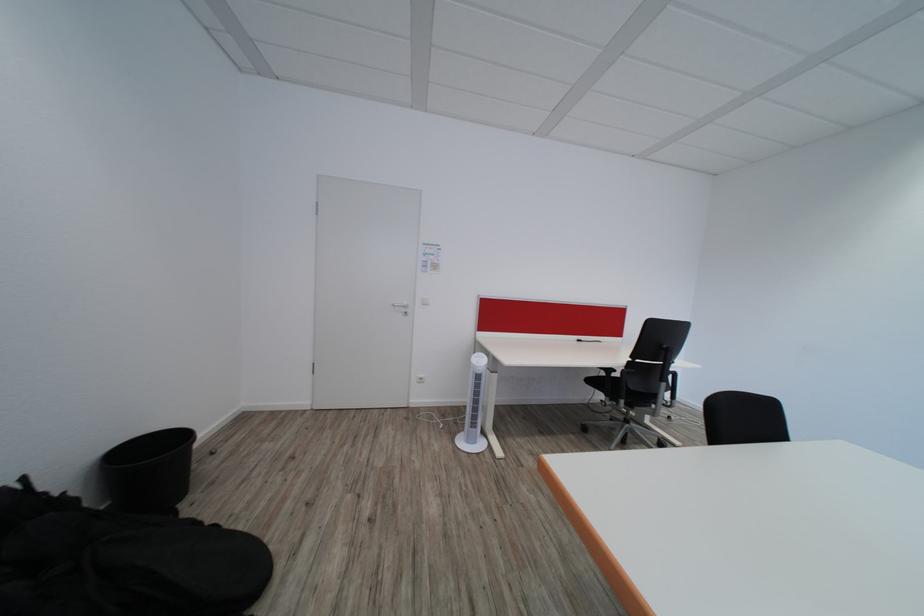
I want to click on silver door handle, so click(x=402, y=305).